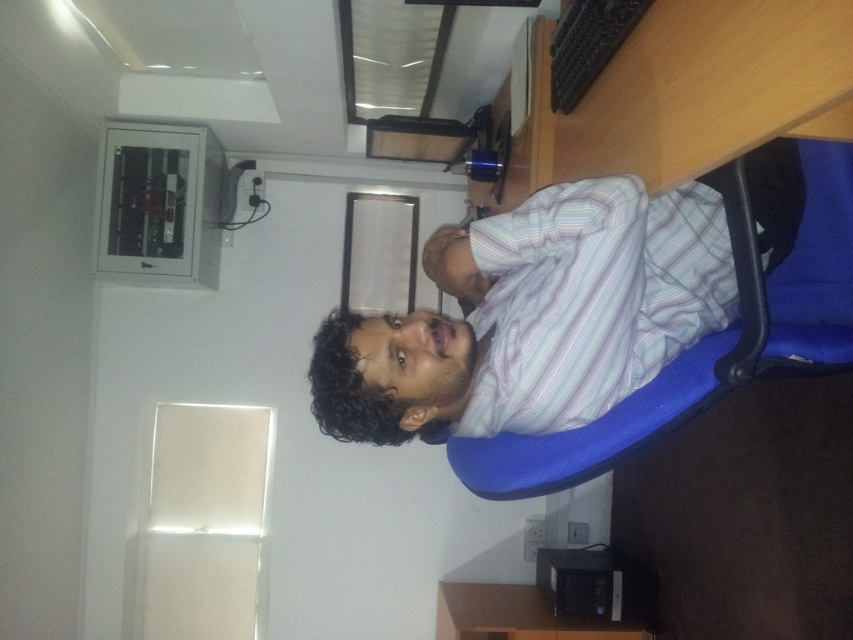
Which is more to the left, white striped shirt at center or black plastic computer at lower center?

Positioned to the left is white striped shirt at center.

Is white striped shirt at center positioned before black plastic computer at lower center?

Yes.

Find the location of `white striped shirt at center`. white striped shirt at center is located at coordinates (534, 316).